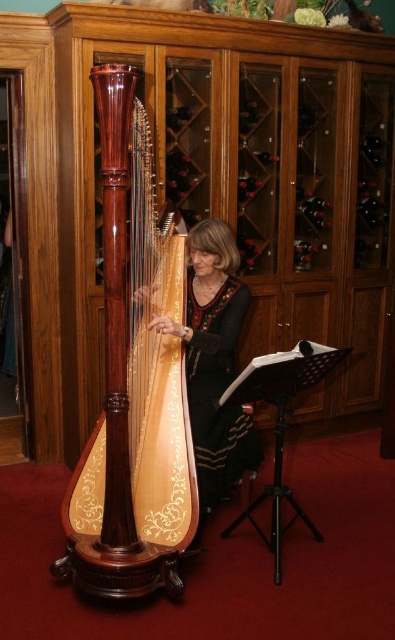
Is polished wood harp at center behind wooden harp at center?

No, polished wood harp at center is in front of wooden harp at center.

Does point (137, 102) lie behind point (216, 472)?

No, it is not.

Which is in front, point (99, 500) or point (220, 440)?

Point (99, 500)

Locate an element on the screen. polished wood harp at center is located at coordinates (133, 381).